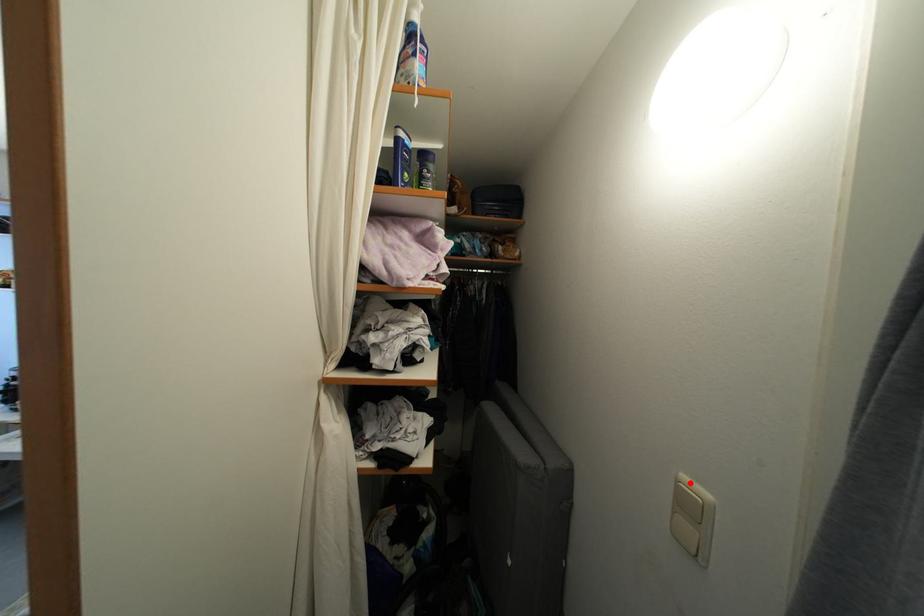
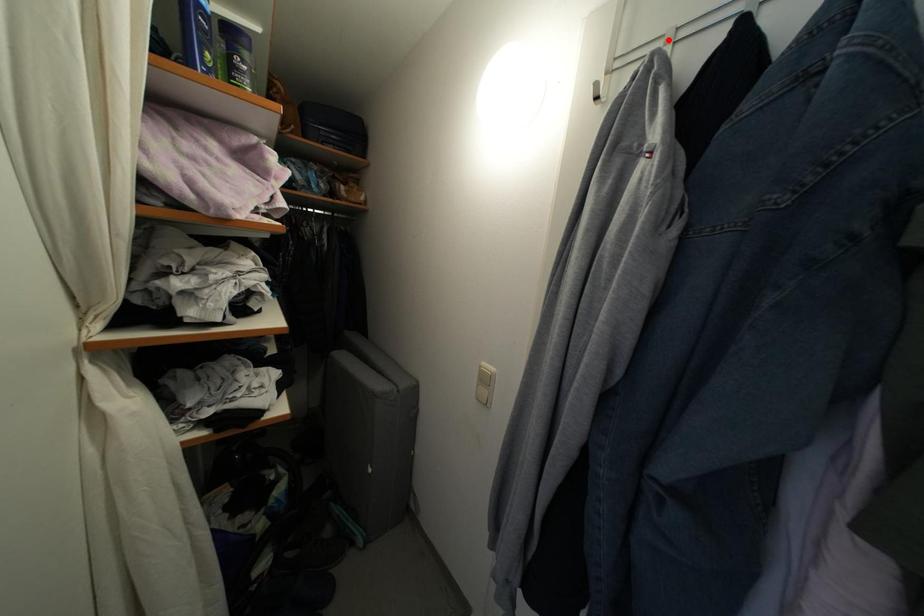
I am providing you with two images of the same scene from different viewpoints. A red point is marked on the first image and another point is marked on the second image. Do the highlighted points in image1 and image2 indicate the same real-world spot?

No